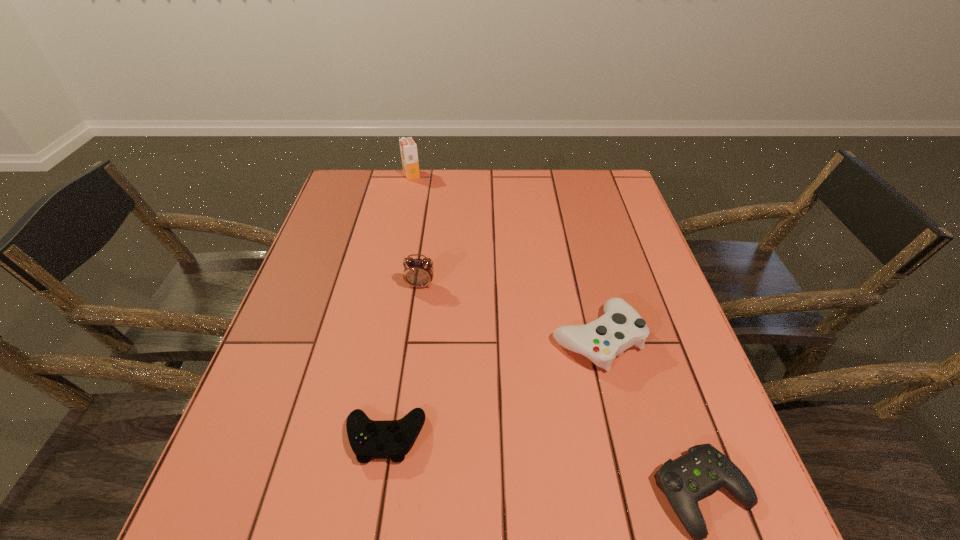
This screenshot has width=960, height=540. In order to click on the tallest object in this screenshot , I will do `click(408, 148)`.

Find the location of a particular element. Image resolution: width=960 pixels, height=540 pixels. the farthest object is located at coordinates (408, 148).

At what (x,y) coordinates should I click in order to perform the action: click on the fourth shortest object. Please return your answer as a coordinate pair (x, y). This screenshot has width=960, height=540. Looking at the image, I should click on (419, 273).

Identify the location of alarm clock. The height and width of the screenshot is (540, 960). (419, 273).

I want to click on the tallest control, so click(x=621, y=327).

The width and height of the screenshot is (960, 540). I want to click on the third nearest object, so click(621, 327).

This screenshot has height=540, width=960. Find the location of `the leftmost control`. the leftmost control is located at coordinates (389, 439).

Locate an element on the screen. vacant space situated on the right of the farthest object is located at coordinates (510, 175).

This screenshot has width=960, height=540. What are the coordinates of `vacant area situated 0.060m on the face of the second farthest object` in the screenshot? It's located at (418, 308).

In order to click on blank space located on the left of the farthest control in this screenshot , I will do `click(427, 338)`.